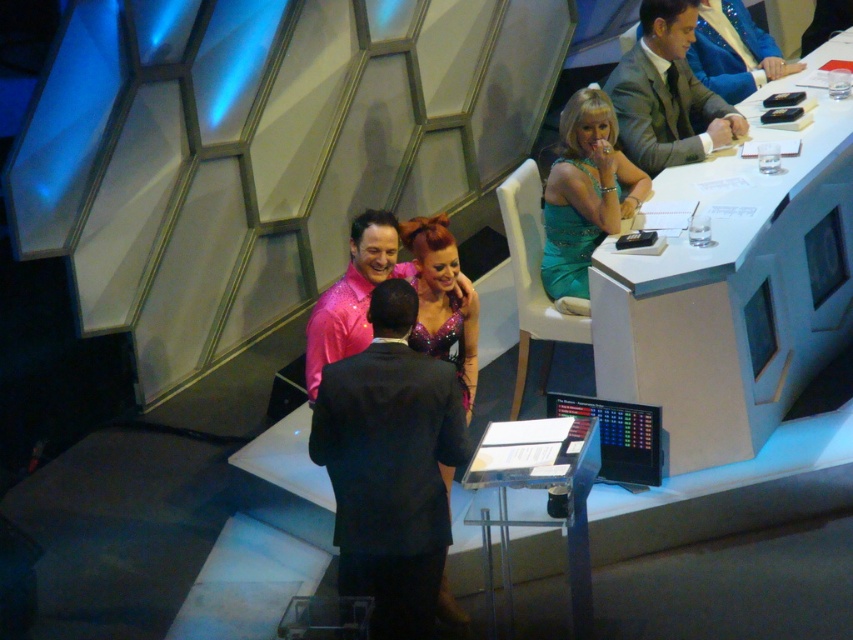
Does white plastic table at upper right have a greater height compared to sparkly purple dress at center?

Correct, white plastic table at upper right is much taller as sparkly purple dress at center.

The image size is (853, 640). What do you see at coordinates (733, 292) in the screenshot? I see `white plastic table at upper right` at bounding box center [733, 292].

Is point (740, 308) farther from camera compared to point (476, 307)?

Yes, point (740, 308) is farther from viewer.

What are the coordinates of `white plastic table at upper right` in the screenshot? It's located at tap(733, 292).

Is teal satin dress at upper right wider than sparkly purple dress at center?

Yes, teal satin dress at upper right is wider than sparkly purple dress at center.

Does teal satin dress at upper right have a lesser height compared to sparkly purple dress at center?

Incorrect, teal satin dress at upper right's height does not fall short of sparkly purple dress at center's.

Does point (596, 124) lie in front of point (465, 397)?

No, it is not.

Locate an element on the screen. teal satin dress at upper right is located at coordinates (585, 193).

Does white plastic table at upper right appear on the right side of teal satin dress at upper right?

Correct, you'll find white plastic table at upper right to the right of teal satin dress at upper right.

Is white plastic table at upper right behind teal satin dress at upper right?

That is False.

Describe the element at coordinates (733, 292) in the screenshot. I see `white plastic table at upper right` at that location.

Locate an element on the screen. white plastic table at upper right is located at coordinates (733, 292).